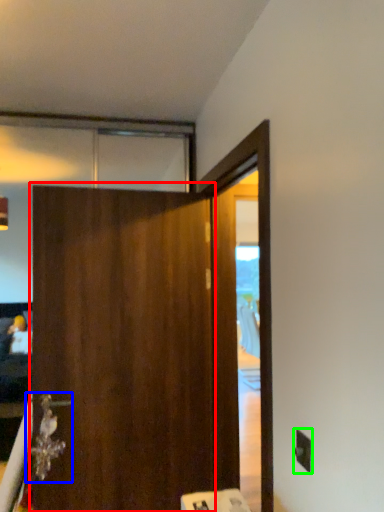
Question: Which object is the closest to the barn door (highlighted by a red box)? Choose among these: door handle (highlighted by a blue box) or electric outlet (highlighted by a green box).

Choices:
 (A) door handle
 (B) electric outlet

Answer: (A)